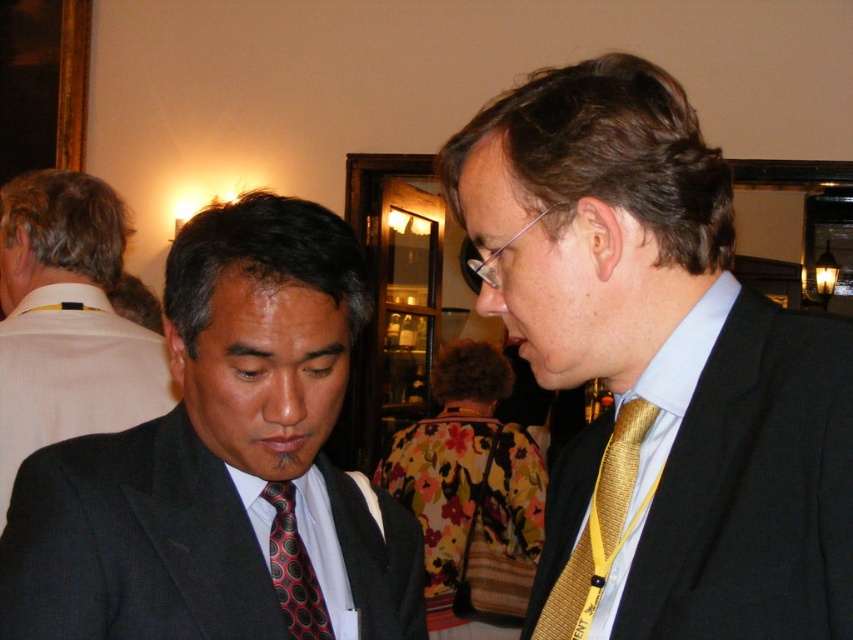
Is point (293, 236) in front of point (631, 413)?

That is False.

Where is `matte black suit at left`? Image resolution: width=853 pixels, height=640 pixels. matte black suit at left is located at coordinates (223, 465).

Can you confirm if gold silk tie at right is wider than red dotted tie at center?

Correct, the width of gold silk tie at right exceeds that of red dotted tie at center.

Who is higher up, gold silk tie at right or red dotted tie at center?

gold silk tie at right is higher up.

Identify the location of gold silk tie at right. This screenshot has width=853, height=640. (619, 468).

Between point (605, 220) and point (625, 401), which one is positioned in front?

Positioned in front is point (605, 220).

Identify the location of gold textured tie at center. The image size is (853, 640). (659, 369).